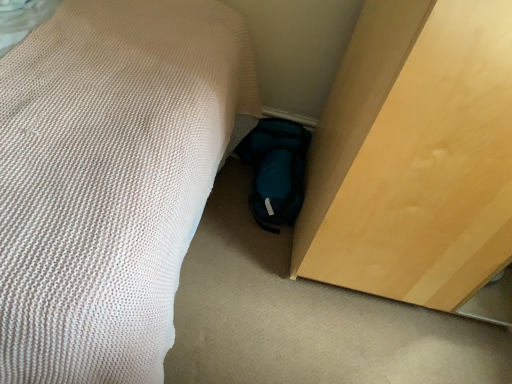
Question: Based on their sizes in the image, would you say light wood cabinet at lower right is bigger or smaller than white textured bed at lower left?

Choices:
 (A) big
 (B) small

Answer: (B)

Question: Is light wood cabinet at lower right inside or outside of white textured bed at lower left?

Choices:
 (A) outside
 (B) inside

Answer: (A)

Question: Which is farther from the teal fabric slipper at lower center?

Choices:
 (A) white textured bed at lower left
 (B) light wood cabinet at lower right

Answer: (A)

Question: Estimate the real-world distances between objects in this image. Which object is farther from the light wood cabinet at lower right?

Choices:
 (A) white textured bed at lower left
 (B) teal fabric slipper at lower center

Answer: (A)